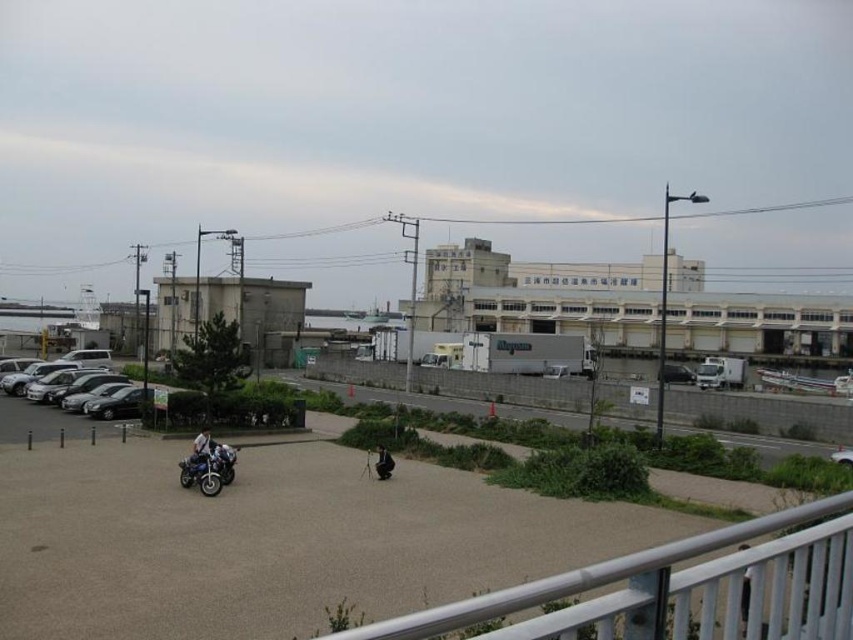
Question: Does shiny black motorcycle at lower left appear on the left side of dark gray fabric jacket at center?

Choices:
 (A) no
 (B) yes

Answer: (B)

Question: Which is nearer to the silver metallic rail at lower right?

Choices:
 (A) dark gray fabric jacket at center
 (B) shiny black motorcycle at lower left
 (C) metallic silver car at center

Answer: (B)

Question: Is silver metallic rail at lower right wider than silver metallic car at left?

Choices:
 (A) no
 (B) yes

Answer: (A)

Question: Is shiny black motorcycle at lower left thinner than shiny metallic motorcycle at lower left?

Choices:
 (A) yes
 (B) no

Answer: (B)

Question: Which of the following is the farthest from the observer?

Choices:
 (A) (206, 465)
 (B) (666, 378)
 (C) (815, 545)

Answer: (B)

Question: Which of the following is the closest to the observer?

Choices:
 (A) (675, 378)
 (B) (231, 468)

Answer: (B)